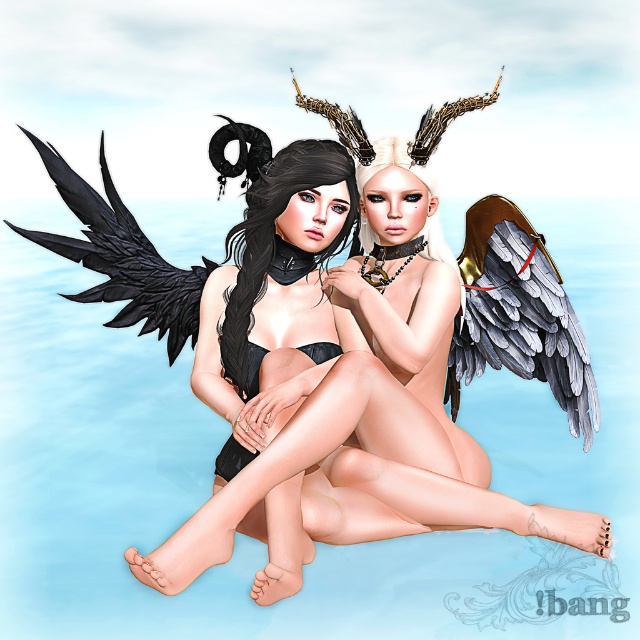
You are an artist trying to draw the two characters in the scene. You want to ensure proper depth perception. Which of the two points, point (416, 214) or point (506, 362), is closer to the viewer?

Point (416, 214) is closer to the viewer than point (506, 362).

You are an art student analyzing the composition of this image. You notice two black matte wings at upper left and a black matte wing at left. Which of these wings appears closer to you in the artwork?

The black matte wings at upper left appears closer to the viewer than the black matte wing at left.

You are a photographer standing 2 meters away from the black matte wings at upper left. Can you take a closer photo without moving? Explain why or why not.

The black matte wings at upper left are 2.13 meters away from the viewer. Since you are already standing 2 meters away, you can move 0.13 meters closer to take a better photo.